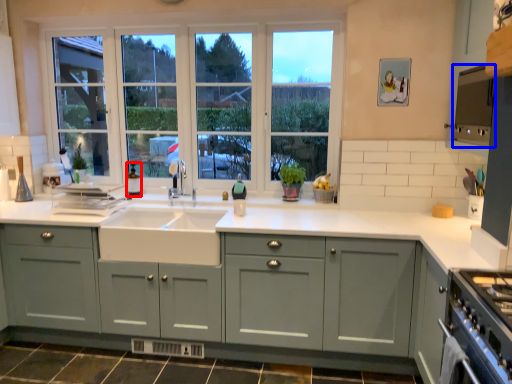
Question: Among these objects, which one is nearest to the camera, bottle (highlighted by a red box) or appliance (highlighted by a blue box)?

Choices:
 (A) bottle
 (B) appliance

Answer: (B)